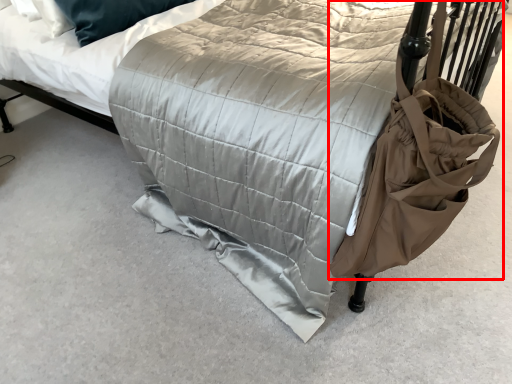
Question: From the image's perspective, what is the correct spatial relationship of bag (annotated by the red box) in relation to mattress?

Choices:
 (A) above
 (B) below

Answer: (B)